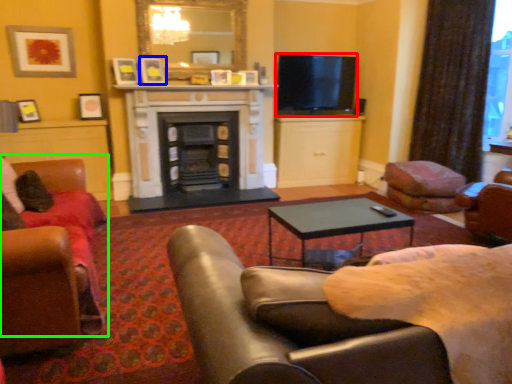
Question: Considering the real-world distances, which object is farthest from television (highlighted by a red box)? picture frame (highlighted by a blue box) or chair (highlighted by a green box)?

Choices:
 (A) picture frame
 (B) chair

Answer: (B)